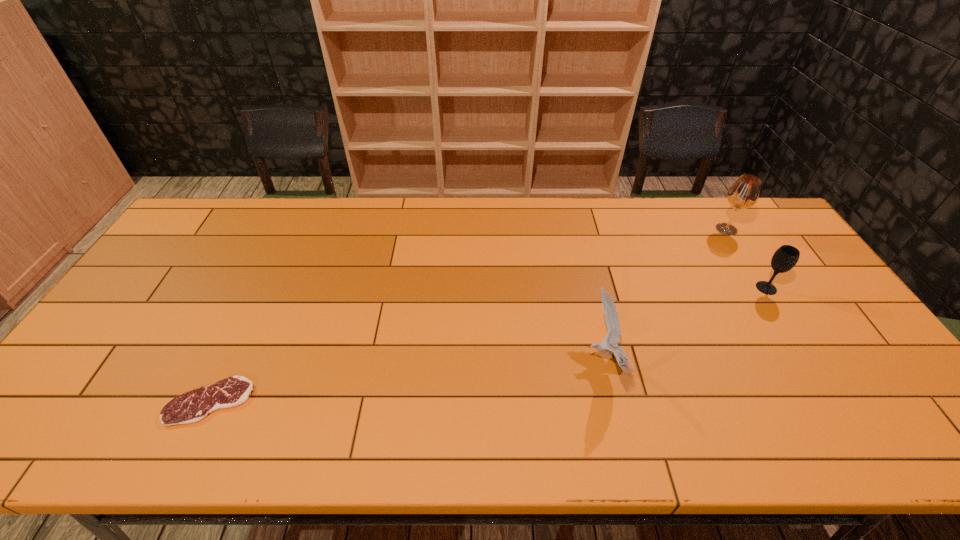
Where is `blank space located at the tip of the beak of the gull`? This screenshot has width=960, height=540. blank space located at the tip of the beak of the gull is located at coordinates (486, 360).

Find the location of a particular element. The image size is (960, 540). vacant space located at the tip of the beak of the gull is located at coordinates click(540, 360).

Find the location of a particular element. This screenshot has width=960, height=540. vacant space located 0.360m on the right of the shortest object is located at coordinates (403, 401).

Locate an element on the screen. object present at the far edge is located at coordinates (744, 193).

Where is `object situated at the near edge`? This screenshot has width=960, height=540. object situated at the near edge is located at coordinates (193, 406).

Find the location of a particular element. This screenshot has width=960, height=540. object that is at the far right corner is located at coordinates (744, 193).

Image resolution: width=960 pixels, height=540 pixels. Find the location of `vacant region at the far edge of the desktop`. vacant region at the far edge of the desktop is located at coordinates (402, 203).

Locate an element on the screen. vacant space at the near edge is located at coordinates (599, 423).

Where is `vacant space at the left edge of the desktop`? The image size is (960, 540). vacant space at the left edge of the desktop is located at coordinates (183, 258).

This screenshot has height=540, width=960. I want to click on vacant space at the right edge of the desktop, so click(x=802, y=328).